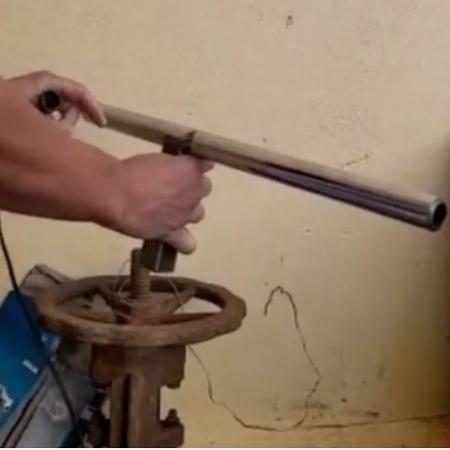
The width and height of the screenshot is (450, 450). I want to click on handles, so click(x=348, y=194), click(x=111, y=126).